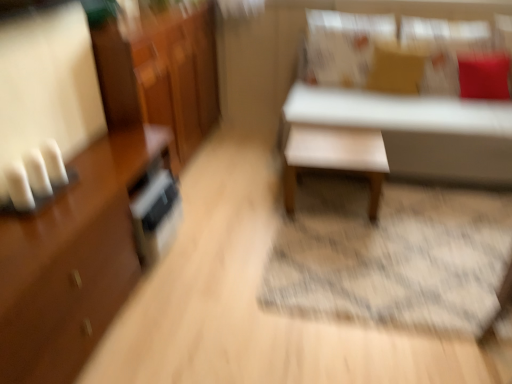
Question: From the image's perspective, relative to shiny brown dresser at left, is matte brown pillow at upper center, the second pillow from the right, above or below?

Choices:
 (A) above
 (B) below

Answer: (A)

Question: Considering the positions of matte brown pillow at upper center, the second pillow from the right, and shiny brown dresser at left in the image, is matte brown pillow at upper center, the second pillow from the right, wider or thinner than shiny brown dresser at left?

Choices:
 (A) thin
 (B) wide

Answer: (A)

Question: Which of these objects is positioned closest to the white matte bench at upper right, acting as the first table starting from the right?

Choices:
 (A) red velvet cushion at upper right, the first pillow when ordered from right to left
 (B) shiny brown dresser at left
 (C) brown glossy cabinet at left
 (D) white fabric pillow at upper right, which ranks as the 3th pillow in right-to-left order
 (E) matte brown pillow at upper center, the second pillow viewed from the left

Answer: (E)

Question: Considering the real-world distances, which object is farthest from the white fabric pillow at upper right, which ranks as the 3th pillow in right-to-left order?

Choices:
 (A) matte brown pillow at upper center, the second pillow from the right
 (B) red velvet cushion at upper right, which is counted as the third pillow, starting from the left
 (C) brown glossy cabinet at left
 (D) white matte bench at upper right, arranged as the 2th table when viewed from the left
 (E) shiny brown dresser at left

Answer: (C)